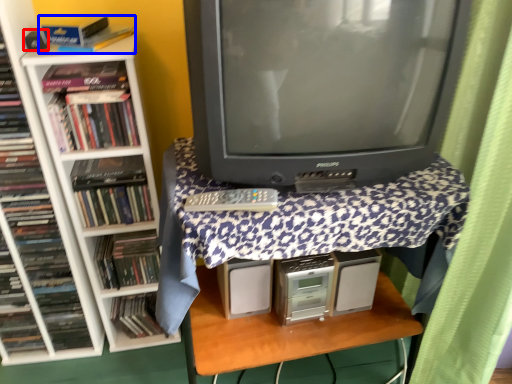
Question: Which point is further to the camera, speaker (highlighted by a red box) or book (highlighted by a blue box)?

Choices:
 (A) speaker
 (B) book

Answer: (A)